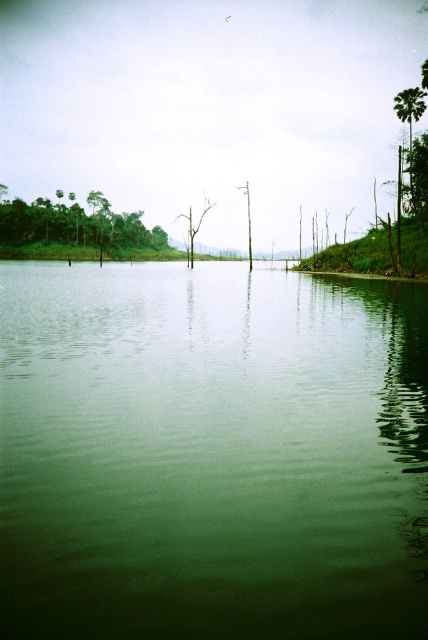
You are an environmental researcher analyzing the image. You need to determine which area has more visual coverage between the green leafy trees at upper left and the bare wood tree at center. Which one has a larger visual footprint in the image?

The bare wood tree at center has a larger visual footprint than the green leafy trees at upper left, as it occupies more space in the image.

Based on the photo, you are standing on a small boat in the middle of the lake. You notice the green smooth water at center and the bare wood tree at center. Which object is closer to you?

The green smooth water at center is closer to you because it is in front of the bare wood tree at center.

You are standing at the edge of the lake and see two points marked on the water surface. The first point is at coordinates point (41, 224) and the second is at point (198, 225). If you want to reach the point that is closer to you, which one should you go to?

The point at coordinates point (41, 224) is closer to you because it is in front of point (198, 225).